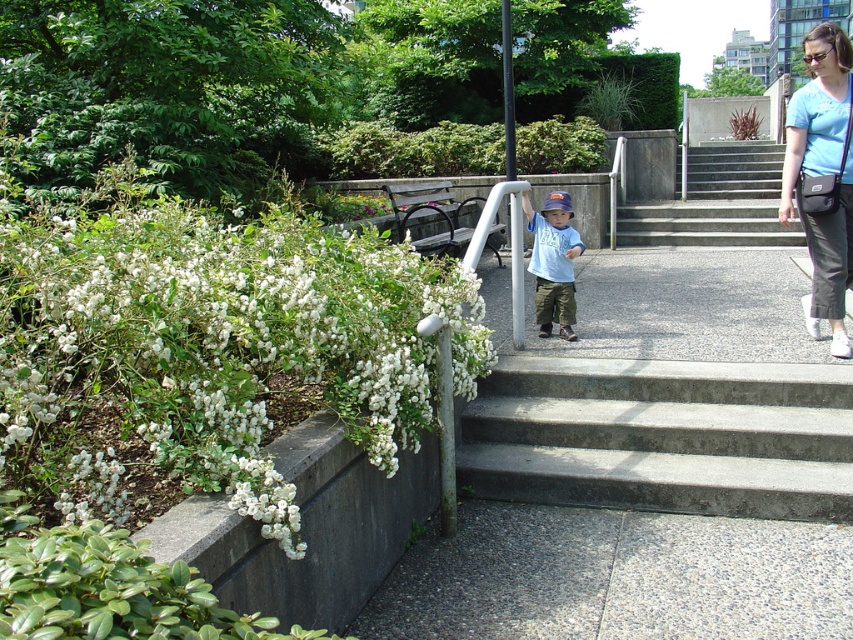
Is gray concrete stairs at center closer to the viewer compared to concrete stairs at center?

Yes, it is.

Does point (784, 509) come farther from viewer compared to point (759, 230)?

No, it is not.

Where is `gray concrete stairs at center`? gray concrete stairs at center is located at coordinates (663, 436).

Which of these two, gray concrete stairs at center or matte blue shirt at center, stands shorter?

With less height is gray concrete stairs at center.

Is gray concrete stairs at center shorter than matte blue shirt at center?

Yes, gray concrete stairs at center is shorter than matte blue shirt at center.

Between point (743, 493) and point (566, 264), which one is positioned behind?

Positioned behind is point (566, 264).

Where is `gray concrete stairs at center`? The width and height of the screenshot is (853, 640). gray concrete stairs at center is located at coordinates (663, 436).

Between blue t-shirt at upper right and concrete stairs at center, which one has less height?

With less height is blue t-shirt at upper right.

Which is in front, point (849, 260) or point (669, 221)?

Positioned in front is point (849, 260).

This screenshot has height=640, width=853. Identify the location of blue t-shirt at upper right. (822, 173).